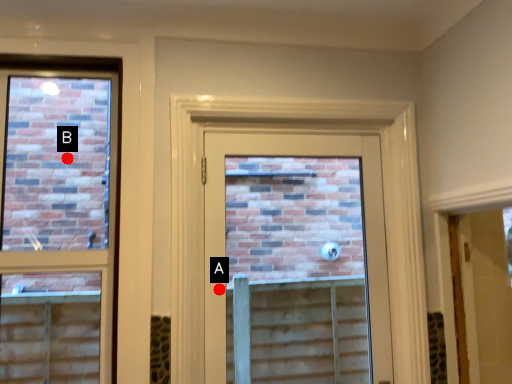
Question: Two points are circled on the image, labeled by A and B beside each circle. Which point is closer to the camera?

Choices:
 (A) A is closer
 (B) B is closer

Answer: (A)